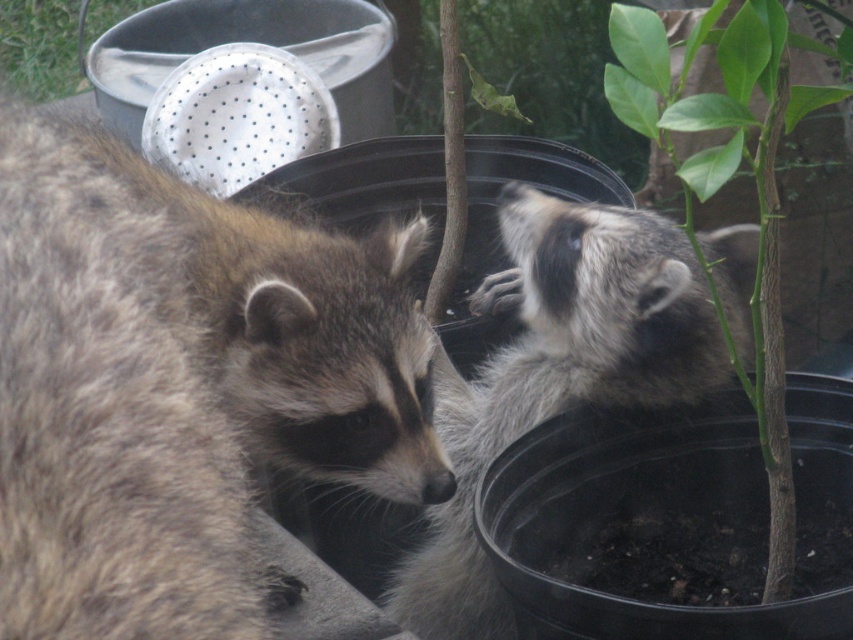
Question: Can you confirm if fuzzy gray raccoon at center is positioned below metallic silver colander at upper left?

Choices:
 (A) yes
 (B) no

Answer: (A)

Question: Is fuzzy brown raccoon at left to the left of fuzzy gray raccoon at center from the viewer's perspective?

Choices:
 (A) yes
 (B) no

Answer: (A)

Question: Considering the real-world distances, which object is farthest from the fuzzy gray raccoon at center?

Choices:
 (A) fuzzy brown raccoon at left
 (B) metallic silver colander at upper left

Answer: (B)

Question: Considering the relative positions of fuzzy brown raccoon at left and metallic silver colander at upper left in the image provided, where is fuzzy brown raccoon at left located with respect to metallic silver colander at upper left?

Choices:
 (A) left
 (B) right

Answer: (B)

Question: Which object is closer to the camera taking this photo?

Choices:
 (A) fuzzy brown raccoon at left
 (B) fuzzy gray raccoon at center
 (C) metallic silver colander at upper left

Answer: (A)

Question: Which point is farther to the camera?

Choices:
 (A) fuzzy brown raccoon at left
 (B) fuzzy gray raccoon at center
 (C) metallic silver colander at upper left

Answer: (C)